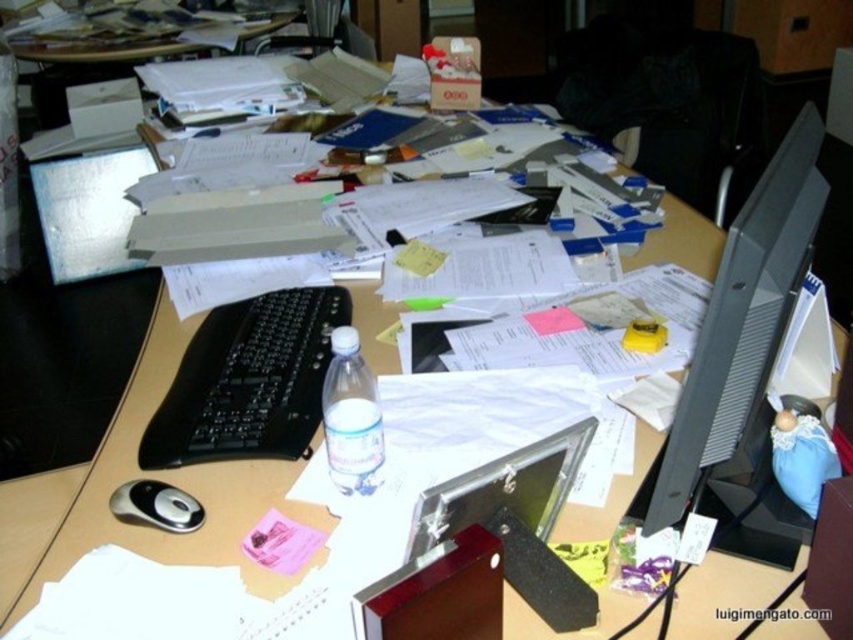
You are organizing the items on the desk and need to place the translucent plastic water bottle at center and the black plastic mouse at lower left into a drawer. The drawer has a narrow compartment that can only fit items with a width of 3 cm or less. Which item should you place in the compartment first, and why?

The translucent plastic water bottle at center is thinner than the black plastic mouse at lower left, so you should place the translucent plastic water bottle at center first since it can fit into the narrow compartment, while the black plastic mouse at lower left may not fit due to its larger width.